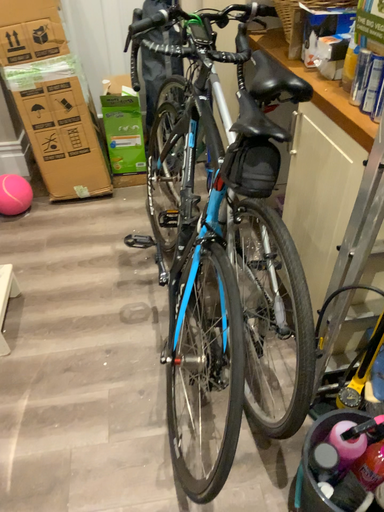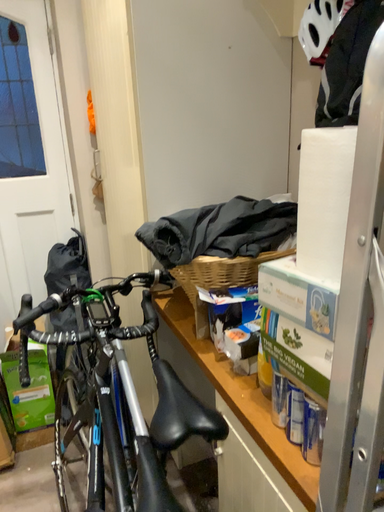
Question: How did the camera likely rotate when shooting the video?

Choices:
 (A) rotated left
 (B) rotated right

Answer: (B)